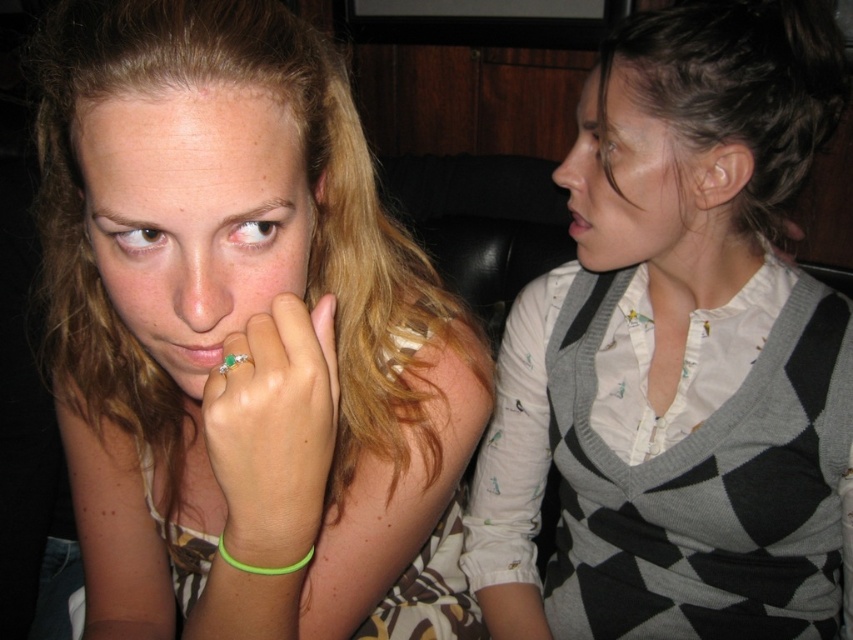
You are an AI analyzing facial positions in images. In the scene described, where is the smooth skin face at upper right located in terms of its 2D coordinates?

The smooth skin face at upper right is located at the 2D coordinates point (633, 184).

You are a photographer trying to capture a closeup of both the gold ring at center and the smooth skin face at upper right in the image. Given that your camera can only focus on objects within a 12 inch range, will you be able to capture both in focus?

The gold ring at center is 14.13 inches away from smooth skin face at upper right, which exceeds the camera focus range of 12 inches. Therefore, you cannot capture both in focus simultaneously.